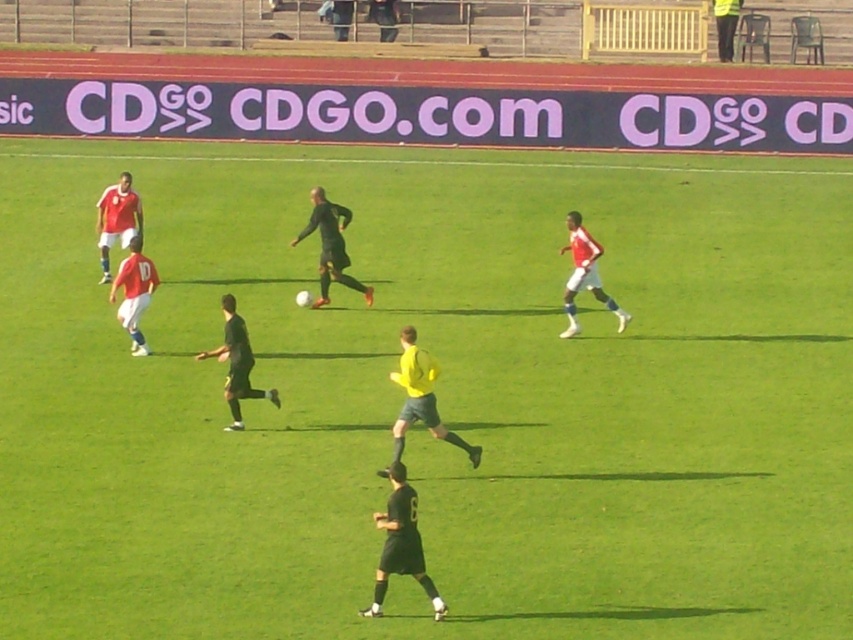
Question: Does black matte referee at center have a greater width compared to matte red jersey at center?

Choices:
 (A) no
 (B) yes

Answer: (A)

Question: Which object is positioned closest to the matte red jersey at upper left?

Choices:
 (A) matte red jersey at center
 (B) yellow matte shirt at center

Answer: (A)

Question: Which object is farther from the camera taking this photo?

Choices:
 (A) black matte uniform at center
 (B) matte red jersey at center

Answer: (B)

Question: Which of the following is the farthest from the observer?

Choices:
 (A) black matte soccer player at center
 (B) matte red jersey at left

Answer: (A)

Question: Is black matte soccer player at center bigger than matte red jersey at left?

Choices:
 (A) yes
 (B) no

Answer: (A)

Question: Does yellow matte shirt at center appear on the right side of black matte soccer player at center?

Choices:
 (A) no
 (B) yes

Answer: (B)